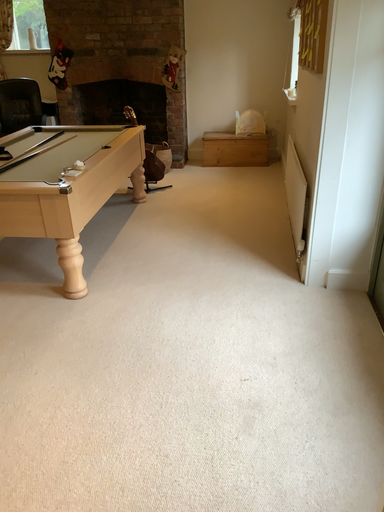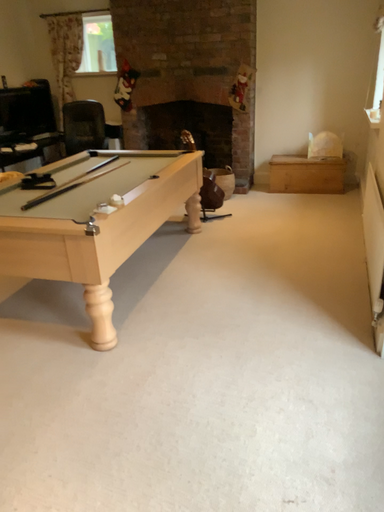
Question: Which way did the camera rotate in the video?

Choices:
 (A) rotated left
 (B) rotated right

Answer: (A)